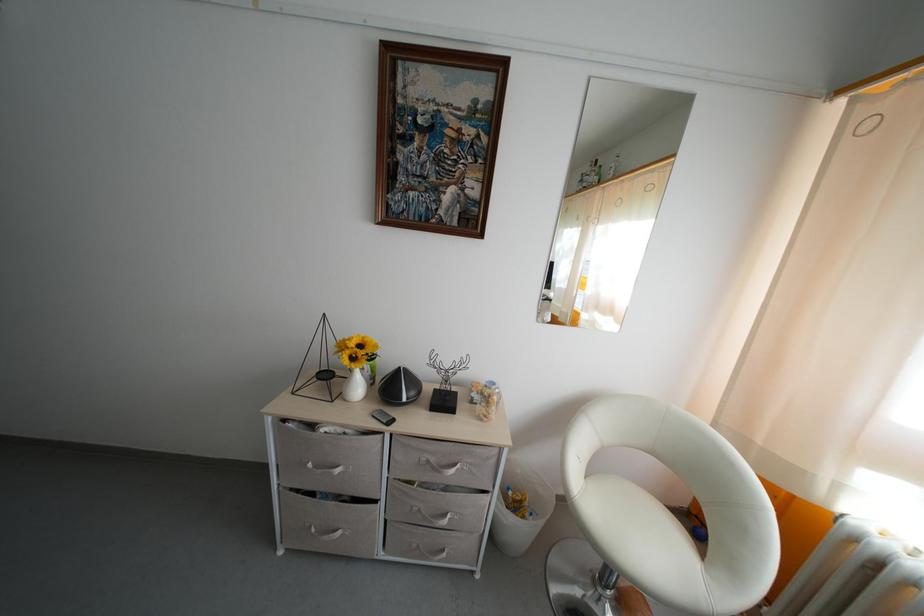
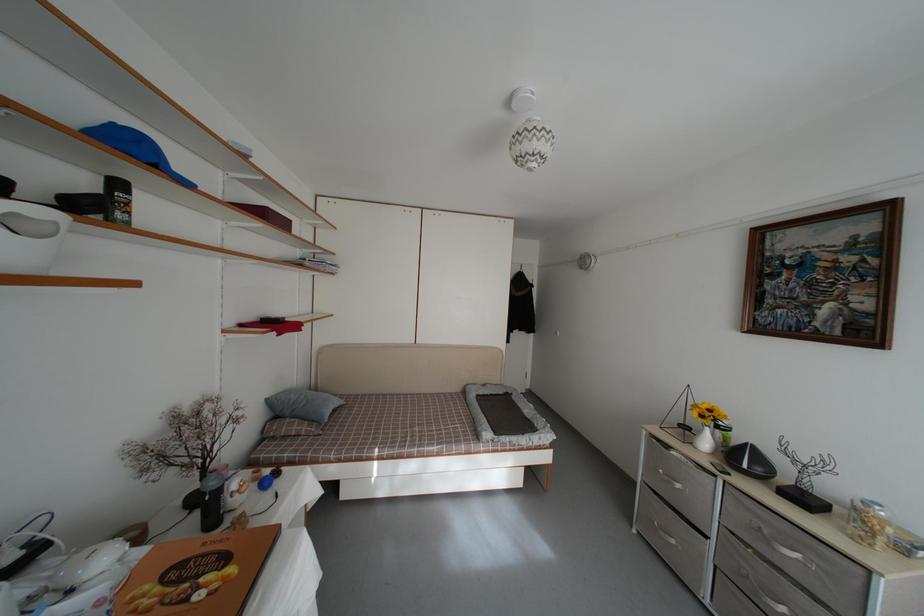
In the second image, find the point that corresponds to point (379, 376) in the first image.

(731, 446)